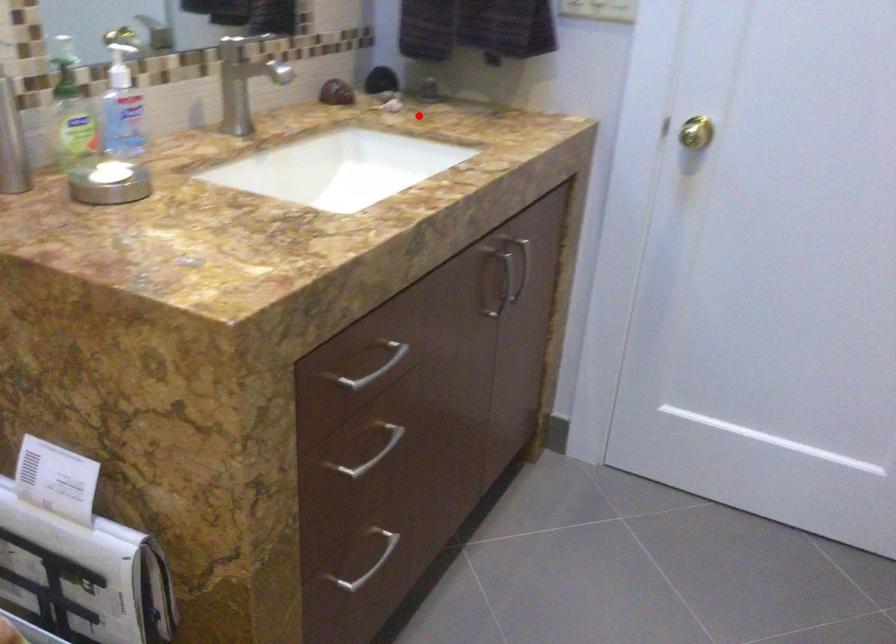
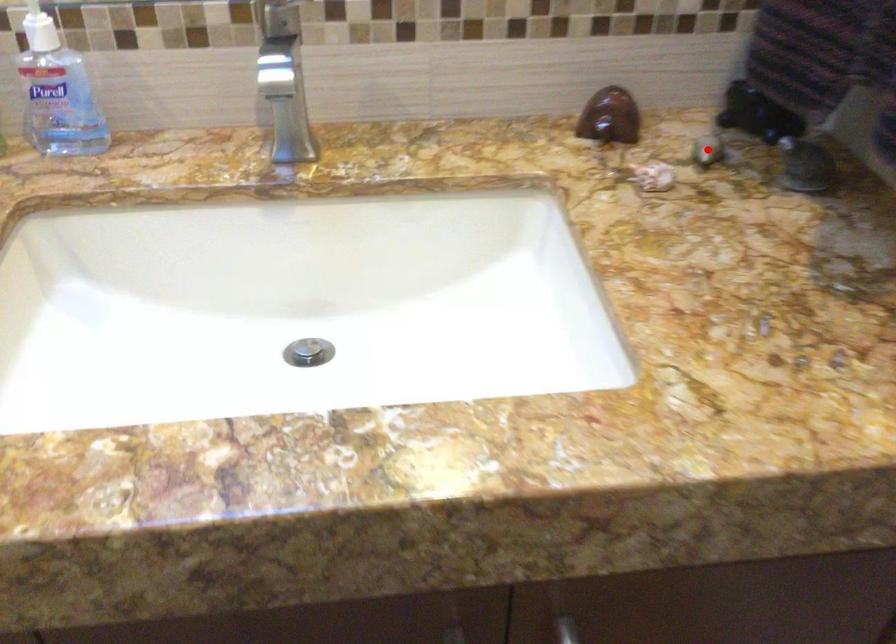
I am providing you with two images of the same scene from different viewpoints. A red point is marked on the first image and another point is marked on the second image. Is the marked point in image1 the same physical position as the marked point in image2?

Yes